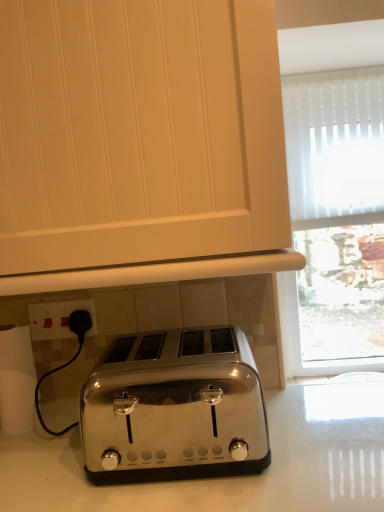
Question: Considering the relative positions of white paper towel at lower left and white plastic switch at lower left in the image provided, is white paper towel at lower left to the left or to the right of white plastic switch at lower left?

Choices:
 (A) right
 (B) left

Answer: (B)

Question: From the image's perspective, is white paper towel at lower left positioned above or below white plastic switch at lower left?

Choices:
 (A) below
 (B) above

Answer: (A)

Question: Which object is the farthest from the satin chrome toaster at center?

Choices:
 (A) satin chrome toaster at lower center
 (B) white paper towel at lower left
 (C) white plastic switch at lower left

Answer: (A)

Question: Considering the real-world distances, which object is closest to the white plastic switch at lower left?

Choices:
 (A) satin chrome toaster at lower center
 (B) satin chrome toaster at center
 (C) white paper towel at lower left

Answer: (C)